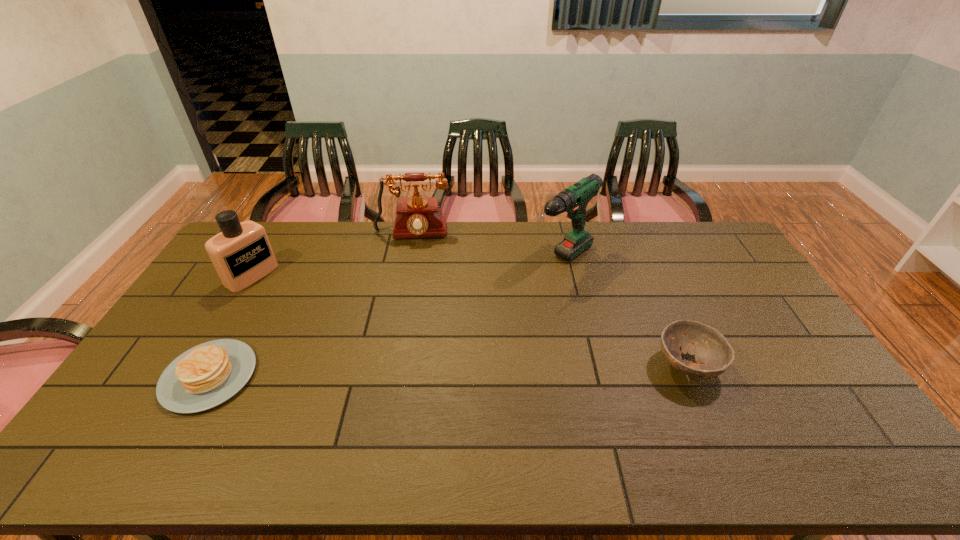
Where is `free space located on the front label of the perfume`? Image resolution: width=960 pixels, height=540 pixels. free space located on the front label of the perfume is located at coordinates (298, 304).

You are a GUI agent. You are given a task and a screenshot of the screen. Output one action in this format:
    pyautogui.click(x=<x>, y=<y>)
    Task: Click on the free space located on the front label of the perfume
    This screenshot has width=960, height=540.
    Given the screenshot: What is the action you would take?
    pyautogui.click(x=329, y=323)

Where is `free spot located on the handle side of the drill`? The height and width of the screenshot is (540, 960). free spot located on the handle side of the drill is located at coordinates (494, 309).

This screenshot has height=540, width=960. In order to click on vacant region located on the handle side of the drill in this screenshot , I will do `click(479, 321)`.

The width and height of the screenshot is (960, 540). Find the location of `free space located on the handle side of the drill`. free space located on the handle side of the drill is located at coordinates (502, 303).

You are a GUI agent. You are given a task and a screenshot of the screen. Output one action in this format:
    pyautogui.click(x=<x>, y=<y>)
    Task: Click on the free spot located 0.180m on the dial of the telephone
    This screenshot has height=540, width=960.
    Given the screenshot: What is the action you would take?
    pyautogui.click(x=410, y=277)

Find the location of a particular element. The height and width of the screenshot is (540, 960). vacant region located on the dial of the telephone is located at coordinates (406, 320).

You are a GUI agent. You are given a task and a screenshot of the screen. Output one action in this format:
    pyautogui.click(x=<x>, y=<y>)
    Task: Click on the free spot located on the dial of the telephone
    The height and width of the screenshot is (540, 960).
    Given the screenshot: What is the action you would take?
    pyautogui.click(x=409, y=286)

Locate an element on the screen. Image resolution: width=960 pixels, height=540 pixels. drill present at the far edge is located at coordinates (574, 199).

This screenshot has height=540, width=960. I want to click on telephone that is at the far edge, so click(417, 217).